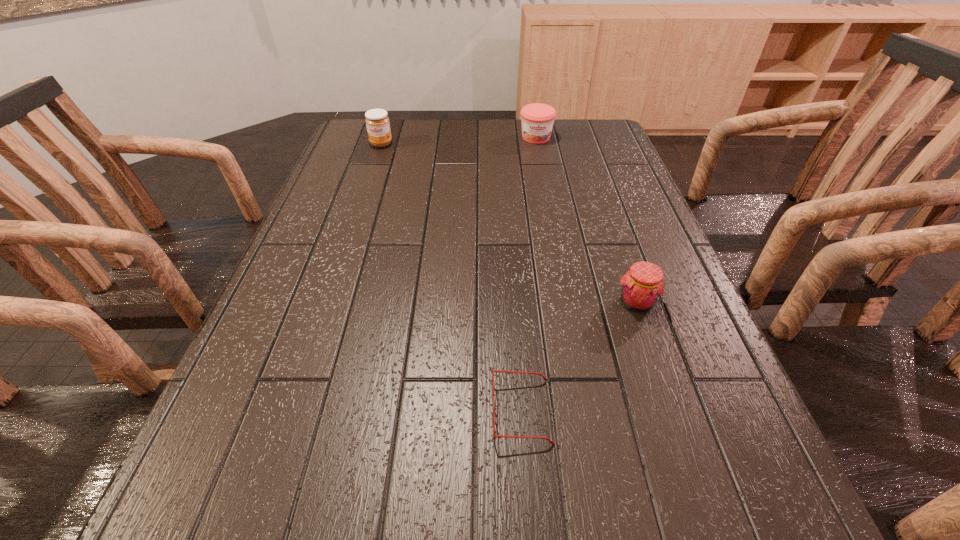
Identify the location of free area in between the nearest object and the leftmost jam. This screenshot has height=540, width=960. (451, 278).

You are a GUI agent. You are given a task and a screenshot of the screen. Output one action in this format:
    pyautogui.click(x=<x>, y=<y>)
    Task: Click on the object that is the third closest one to the second object from right to left
    The height and width of the screenshot is (540, 960).
    Given the screenshot: What is the action you would take?
    pyautogui.click(x=499, y=436)

This screenshot has width=960, height=540. In order to click on the second closest object to the nearest object in this screenshot , I will do `click(537, 119)`.

Where is `the closest jam relative to the third object from left to right`? Image resolution: width=960 pixels, height=540 pixels. the closest jam relative to the third object from left to right is located at coordinates (377, 122).

Point out which jam is positioned as the second nearest to the nearest object. Please provide its 2D coordinates. Your answer should be formatted as a tuple, i.e. [(x, y)], where the tuple contains the x and y coordinates of a point satisfying the conditions above.

[(537, 119)]

This screenshot has width=960, height=540. I want to click on free point that satisfies the following two spatial constraints: 1. on the front label of the nearest jam; 2. on the right side of the second jam from right to left, so click(x=568, y=302).

At what (x,y) coordinates should I click in order to perform the action: click on vacant position in the image that satisfies the following two spatial constraints: 1. on the front label of the second jam from right to left; 2. on the face of the shortest object. Please return your answer as a coordinate pair (x, y). Looking at the image, I should click on (589, 412).

Find the location of `blank area in the image that satisfies the following two spatial constraints: 1. on the front label of the second jam from right to left; 2. on the face of the nearest object`. blank area in the image that satisfies the following two spatial constraints: 1. on the front label of the second jam from right to left; 2. on the face of the nearest object is located at coordinates tap(589, 412).

Where is `vacant space that satisfies the following two spatial constraints: 1. on the front label of the leftmost jam; 2. on the right side of the nearest jam`? Image resolution: width=960 pixels, height=540 pixels. vacant space that satisfies the following two spatial constraints: 1. on the front label of the leftmost jam; 2. on the right side of the nearest jam is located at coordinates (328, 302).

Find the location of a particular element. This screenshot has height=540, width=960. vacant space that satisfies the following two spatial constraints: 1. on the front label of the leftmost jam; 2. on the left side of the nearest jam is located at coordinates (328, 302).